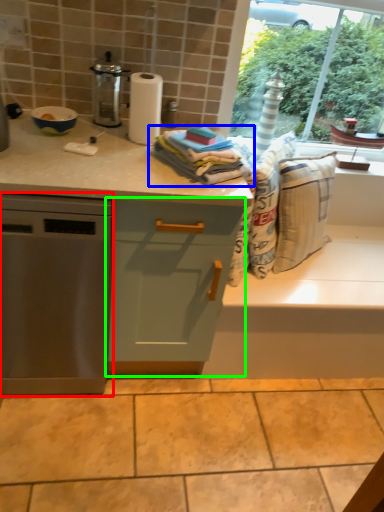
Question: Which object is the farthest from home appliance (highlighted by a red box)? Choose among these: blanket (highlighted by a blue box) or cabinetry (highlighted by a green box).

Choices:
 (A) blanket
 (B) cabinetry

Answer: (A)